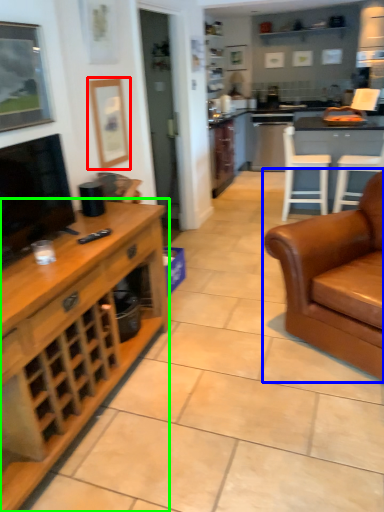
Question: Based on their relative distances, which object is farther from picture frame (highlighted by a red box)? Choose from studio couch (highlighted by a blue box) and cabinetry (highlighted by a green box).

Choices:
 (A) studio couch
 (B) cabinetry

Answer: (A)